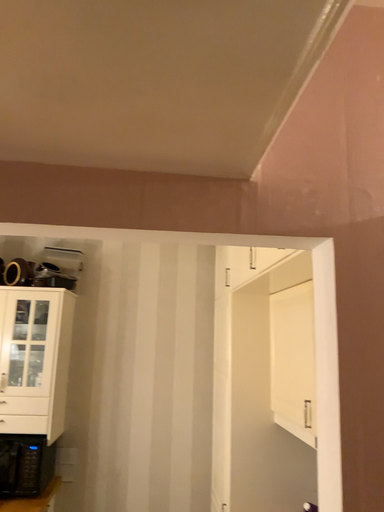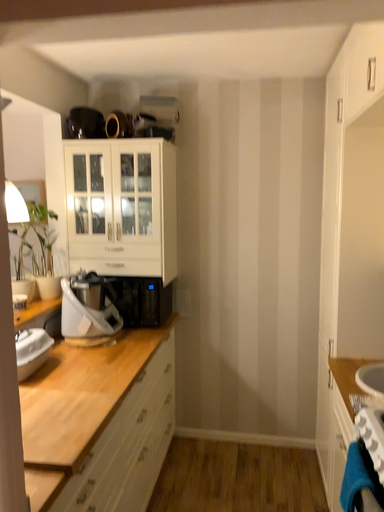
Question: How did the camera likely rotate when shooting the video?

Choices:
 (A) rotated right
 (B) rotated left

Answer: (B)